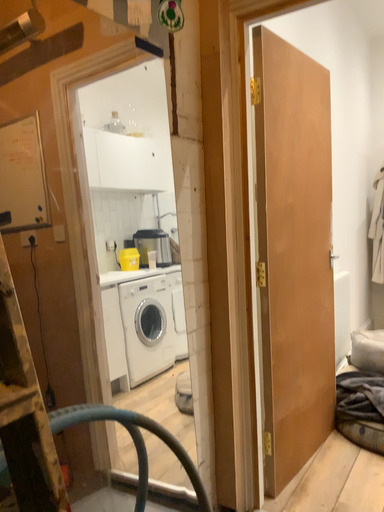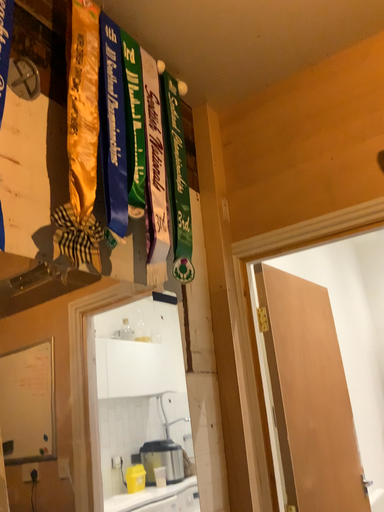
Question: How did the camera likely rotate when shooting the video?

Choices:
 (A) rotated downward
 (B) rotated upward

Answer: (B)